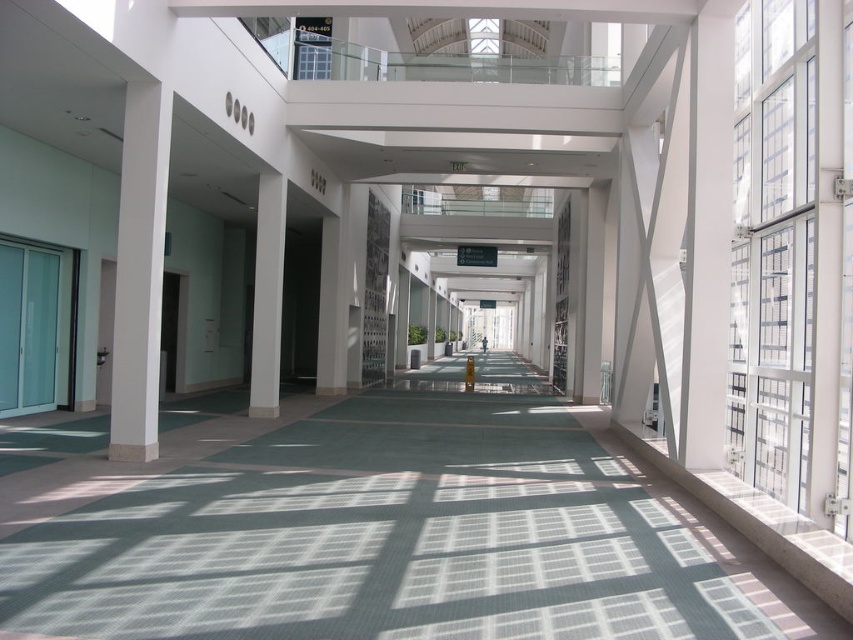
Does green carpet at center have a lesser height compared to white smooth column at left?

Yes, green carpet at center is shorter than white smooth column at left.

Is green carpet at center in front of white smooth column at left?

Yes.

Measure the distance between green carpet at center and camera.

11.50 feet

I want to click on green carpet at center, so tap(373, 531).

Based on the photo, which of these two, green carpet at center or white glossy column at center, stands taller?

white glossy column at center

Between green carpet at center and white glossy column at center, which one has less height?

green carpet at center is shorter.

Is point (305, 589) farther from camera compared to point (260, 256)?

No, it is not.

Locate an element on the screen. The image size is (853, 640). green carpet at center is located at coordinates (373, 531).

Between white smooth column at left and white glossy column at center, which one is positioned higher?

white smooth column at left is higher up.

Measure the distance between white smooth column at left and camera.

They are 7.87 meters apart.

At what (x,y) coordinates should I click in order to perform the action: click on white smooth column at left. Please return your answer as a coordinate pair (x, y). The width and height of the screenshot is (853, 640). Looking at the image, I should click on (138, 273).